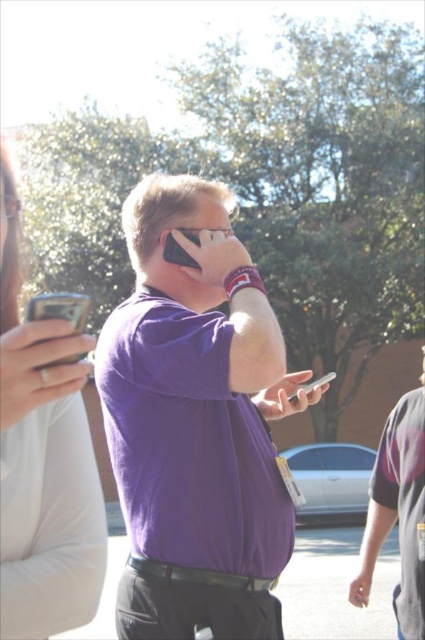
Question: Which point is farther to the camera?

Choices:
 (A) purple matte shirt at center
 (B) matte black phone at left
 (C) silver metallic phone at center
 (D) matte black phone at upper center

Answer: (C)

Question: Which of the following is the closest to the observer?

Choices:
 (A) (45, 310)
 (B) (299, 390)

Answer: (A)

Question: Is purple matte shirt at center below matte black phone at left?

Choices:
 (A) yes
 (B) no

Answer: (A)

Question: Among these points, which one is nearest to the camera?

Choices:
 (A) (62, 417)
 (B) (186, 253)
 (C) (288, 400)

Answer: (A)

Question: From the image, what is the correct spatial relationship of matte black phone at upper center in relation to silver metallic phone at center?

Choices:
 (A) above
 (B) below

Answer: (A)

Question: Does purple matte shirt at center appear under silver metallic phone at center?

Choices:
 (A) yes
 (B) no

Answer: (B)